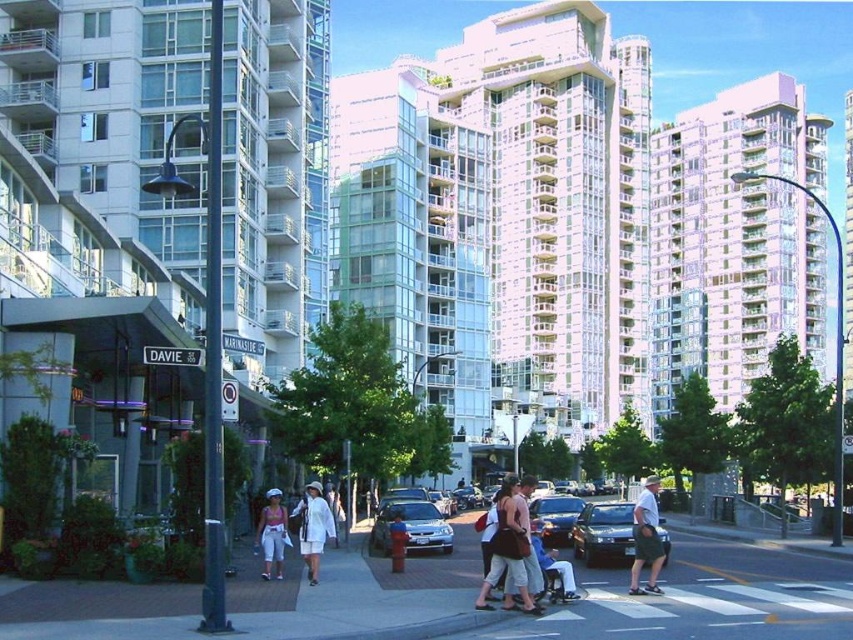
Between concrete sidewalk at center and shiny black sedan at center, which one appears on the right side from the viewer's perspective?

From the viewer's perspective, shiny black sedan at center appears more on the right side.

Can you confirm if concrete sidewalk at center is taller than shiny black sedan at center?

Yes.

Is point (26, 595) positioned after point (624, 552)?

No.

Locate an element on the screen. This screenshot has width=853, height=640. concrete sidewalk at center is located at coordinates (459, 600).

Can you confirm if concrete sidewalk at center is thinner than matte pink shorts at center?

Incorrect, concrete sidewalk at center's width is not less than matte pink shorts at center's.

Does concrete sidewalk at center have a larger size compared to matte pink shorts at center?

Yes.

The width and height of the screenshot is (853, 640). Identify the location of concrete sidewalk at center. (459, 600).

Image resolution: width=853 pixels, height=640 pixels. What are the coordinates of `concrete sidewalk at center` in the screenshot? It's located at (459, 600).

Between concrete sidewalk at center and black rubber skateboard at lower center, which one has less height?

With less height is black rubber skateboard at lower center.

Is point (764, 616) positioned behind point (554, 589)?

No, (764, 616) is in front of (554, 589).

The width and height of the screenshot is (853, 640). In order to click on concrete sidewalk at center in this screenshot , I will do `click(459, 600)`.